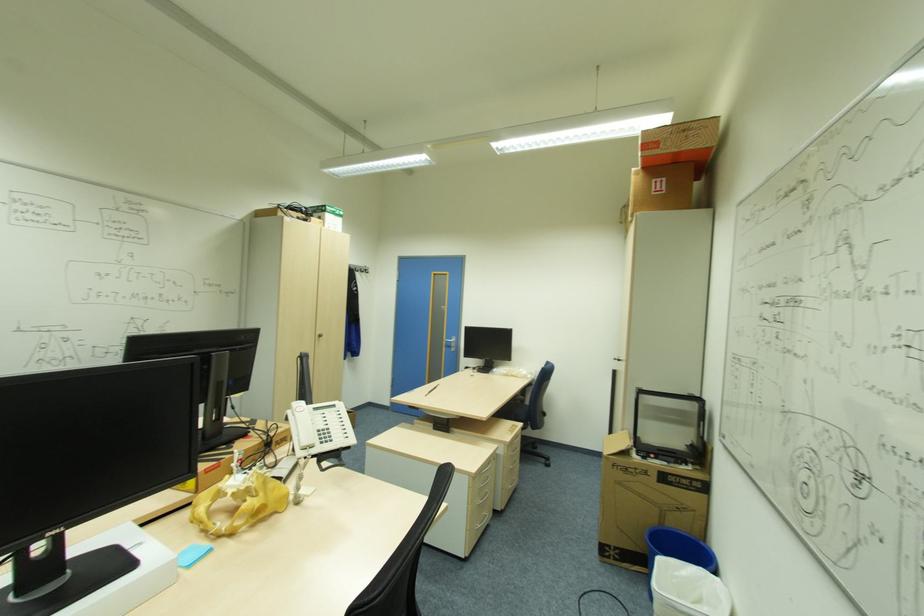
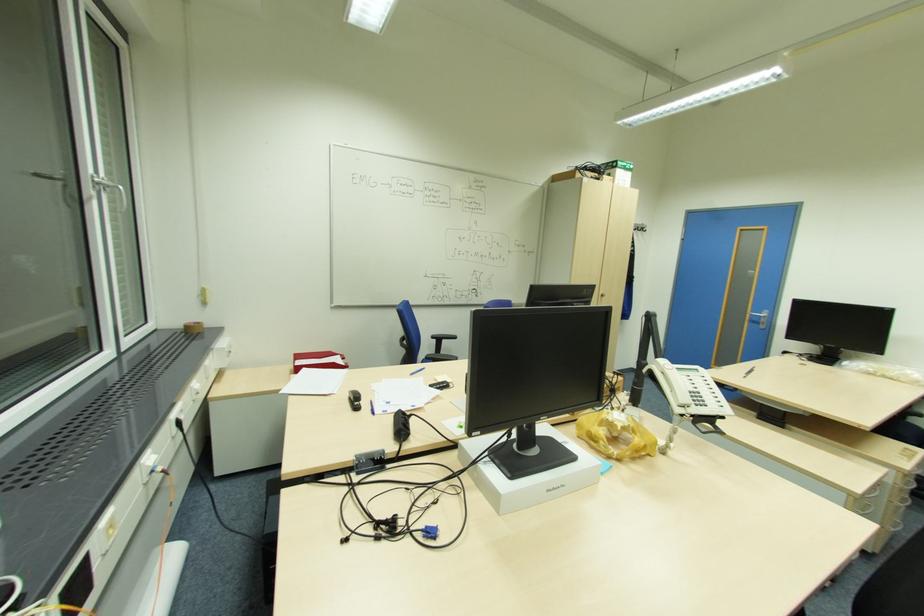
In the second image, find the point that corresponds to [307,443] in the first image.

(685, 400)